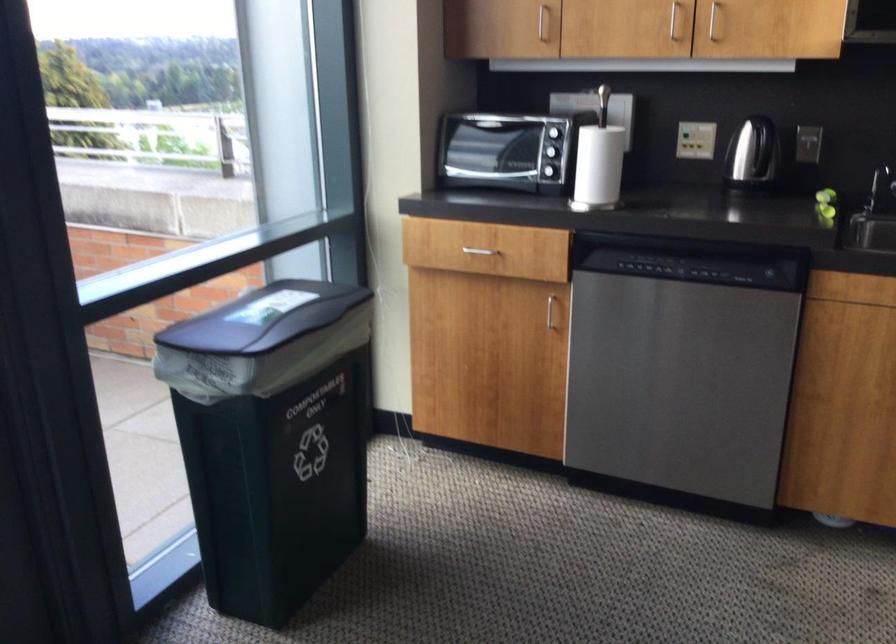
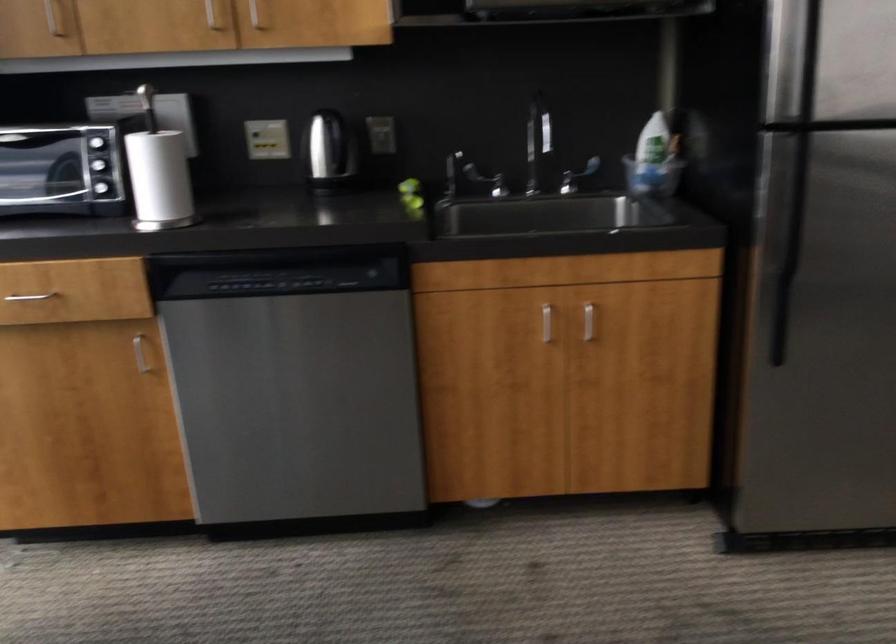
In the second image, find the point that corresponds to point (547, 308) in the first image.

(140, 354)